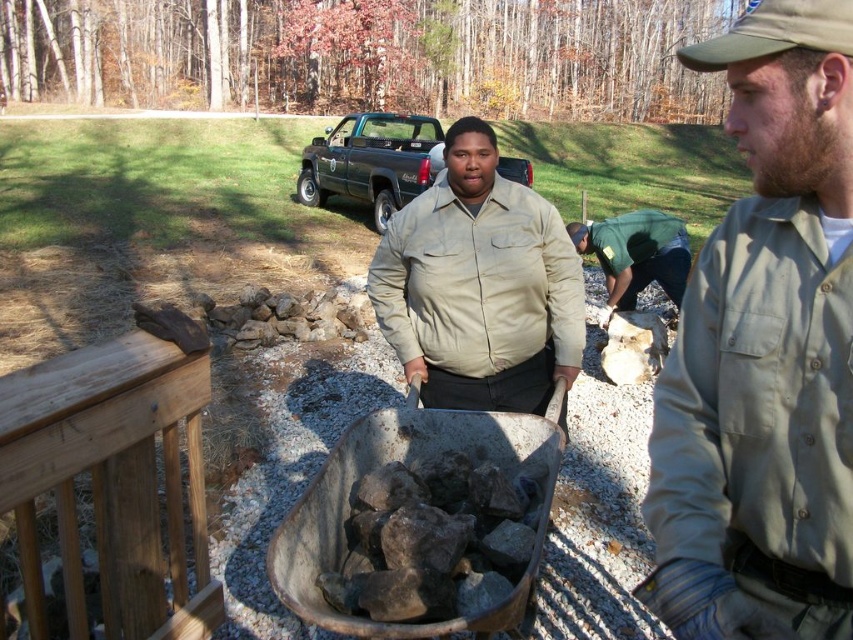
Question: Does khaki button-up shirt at center come behind tan fabric shirt at center?

Choices:
 (A) no
 (B) yes

Answer: (A)

Question: Which of the following is the closest to the observer?

Choices:
 (A) tan fabric shirt at center
 (B) khaki button-up shirt at center
 (C) green uniform at center

Answer: (B)

Question: In this image, where is khaki button-up shirt at center located relative to green uniform at center?

Choices:
 (A) left
 (B) right

Answer: (A)

Question: Is tan fabric shirt at center to the right of green uniform at center from the viewer's perspective?

Choices:
 (A) yes
 (B) no

Answer: (B)

Question: Which of the following is the farthest from the observer?

Choices:
 (A) (546, 208)
 (B) (843, 548)

Answer: (A)

Question: Among these points, which one is nearest to the camera?

Choices:
 (A) (624, 221)
 (B) (457, 330)
 (C) (775, 262)

Answer: (C)